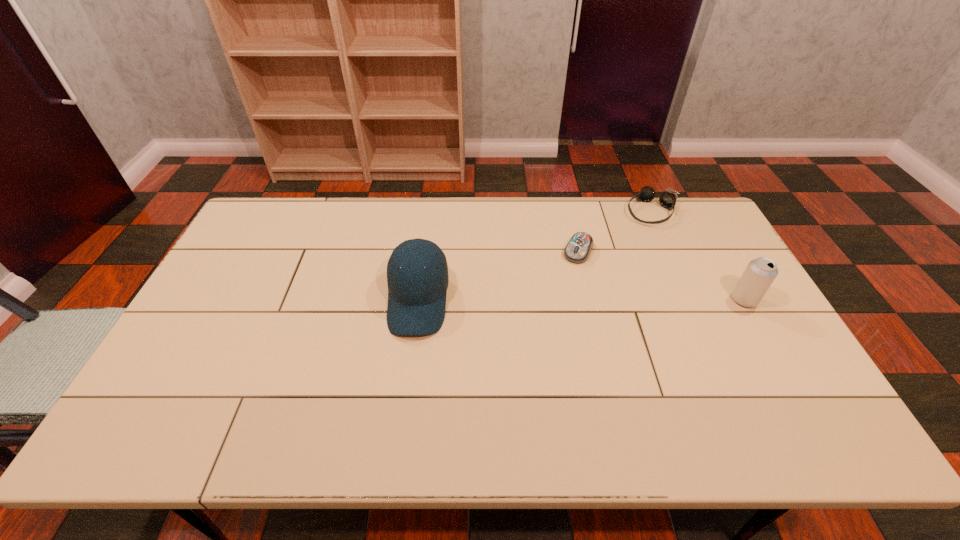
Where is `free space that is in between the shortest object and the rightmost object`? The height and width of the screenshot is (540, 960). free space that is in between the shortest object and the rightmost object is located at coordinates (661, 275).

At what (x,y) coordinates should I click in order to perform the action: click on free point between the shortest object and the third tallest object. Please return your answer as a coordinate pair (x, y). The image size is (960, 540). Looking at the image, I should click on (615, 231).

You are a GUI agent. You are given a task and a screenshot of the screen. Output one action in this format:
    pyautogui.click(x=<x>, y=<y>)
    Task: Click on the blank region between the rightmost object and the second shortest object
    The height and width of the screenshot is (540, 960).
    Given the screenshot: What is the action you would take?
    pyautogui.click(x=698, y=255)

This screenshot has height=540, width=960. I want to click on vacant space that's between the baseball cap and the farthest object, so click(x=535, y=256).

What are the coordinates of `empty space between the second shortest object and the computer mouse` in the screenshot? It's located at (615, 231).

Locate which object ranks second in proximity to the goggles. Please provide its 2D coordinates. Your answer should be formatted as a tuple, i.e. [(x, y)], where the tuple contains the x and y coordinates of a point satisfying the conditions above.

[(760, 273)]

Identify the location of object that ranks as the closest to the farthest object. (578, 249).

Where is `vacant position in the image that satisfies the following two spatial constraints: 1. on the back side of the goggles; 2. on the left side of the shortest object`? vacant position in the image that satisfies the following two spatial constraints: 1. on the back side of the goggles; 2. on the left side of the shortest object is located at coordinates (569, 211).